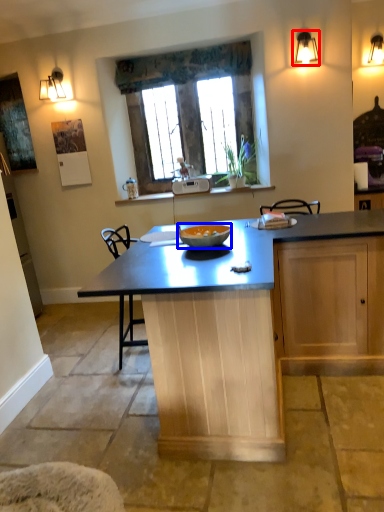
Question: Which of the following is the closest to the observer, light fixture (highlighted by a red box) or glass bowl (highlighted by a blue box)?

Choices:
 (A) light fixture
 (B) glass bowl

Answer: (B)